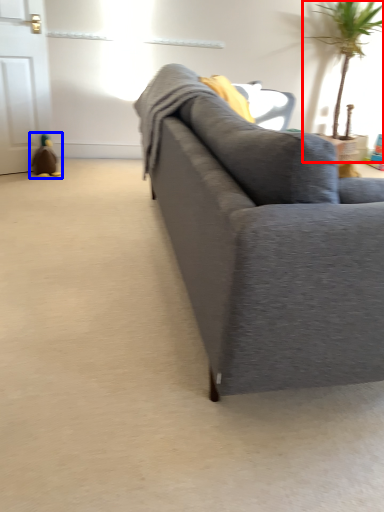
Question: Which object is closer to the camera taking this photo, houseplant (highlighted by a red box) or toy (highlighted by a blue box)?

Choices:
 (A) houseplant
 (B) toy

Answer: (A)